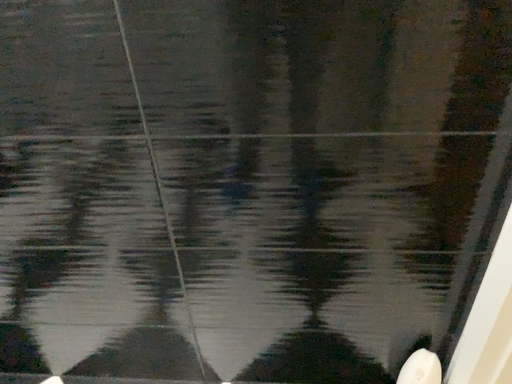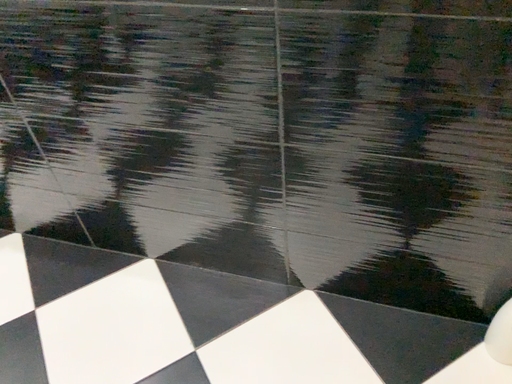
Question: Which way did the camera rotate in the video?

Choices:
 (A) rotated left
 (B) rotated right

Answer: (A)